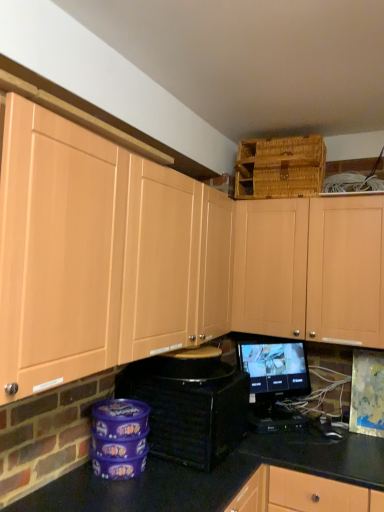
Question: From the image's perspective, is black plastic toaster at lower center below matte wood cabinets at upper left, the first cabinetry positioned from the left?

Choices:
 (A) no
 (B) yes

Answer: (B)

Question: Is black plastic toaster at lower center shorter than matte wood cabinets at upper left, the first cabinetry positioned from the left?

Choices:
 (A) yes
 (B) no

Answer: (A)

Question: Can you confirm if black plastic toaster at lower center is positioned to the left of matte wood cabinets at upper left, arranged as the second cabinetry when viewed from the right?

Choices:
 (A) yes
 (B) no

Answer: (B)

Question: Are black plastic toaster at lower center and matte wood cabinets at upper left, the first cabinetry positioned from the left, far apart?

Choices:
 (A) yes
 (B) no

Answer: (B)

Question: Could you tell me if black plastic toaster at lower center is turned towards matte wood cabinets at upper left, arranged as the second cabinetry when viewed from the right?

Choices:
 (A) yes
 (B) no

Answer: (B)

Question: Would you say matte wood cabinets at upper left, the first cabinetry positioned from the left, is part of black plastic toaster at lower center's contents?

Choices:
 (A) no
 (B) yes

Answer: (A)

Question: Considering the relative sizes of woven brown basket at upper right and matte wood cabinet at upper center, the second cabinetry from the left, in the image provided, is woven brown basket at upper right wider than matte wood cabinet at upper center, the second cabinetry from the left,?

Choices:
 (A) yes
 (B) no

Answer: (A)

Question: Can matte wood cabinet at upper center, the 1th cabinetry from the right, be found inside woven brown basket at upper right?

Choices:
 (A) no
 (B) yes

Answer: (A)

Question: Is the position of woven brown basket at upper right less distant than that of matte wood cabinet at upper center, the 1th cabinetry from the right?

Choices:
 (A) no
 (B) yes

Answer: (A)

Question: Is woven brown basket at upper right oriented towards matte wood cabinet at upper center, the 1th cabinetry from the right?

Choices:
 (A) yes
 (B) no

Answer: (B)

Question: Is woven brown basket at upper right behind matte wood cabinet at upper center, the 1th cabinetry from the right?

Choices:
 (A) yes
 (B) no

Answer: (A)

Question: Is woven brown basket at upper right at the right side of matte wood cabinet at upper center, the 1th cabinetry from the right?

Choices:
 (A) yes
 (B) no

Answer: (B)

Question: Is woven brown basket at upper right wider than black glossy monitor at center?

Choices:
 (A) yes
 (B) no

Answer: (A)